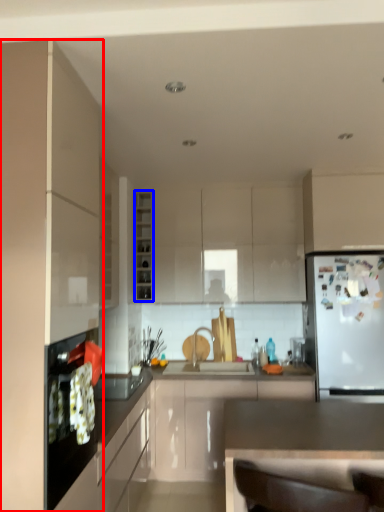
Question: Among these objects, which one is nearest to the camera, cabinetry (highlighted by a red box) or cabinetry (highlighted by a blue box)?

Choices:
 (A) cabinetry
 (B) cabinetry

Answer: (A)